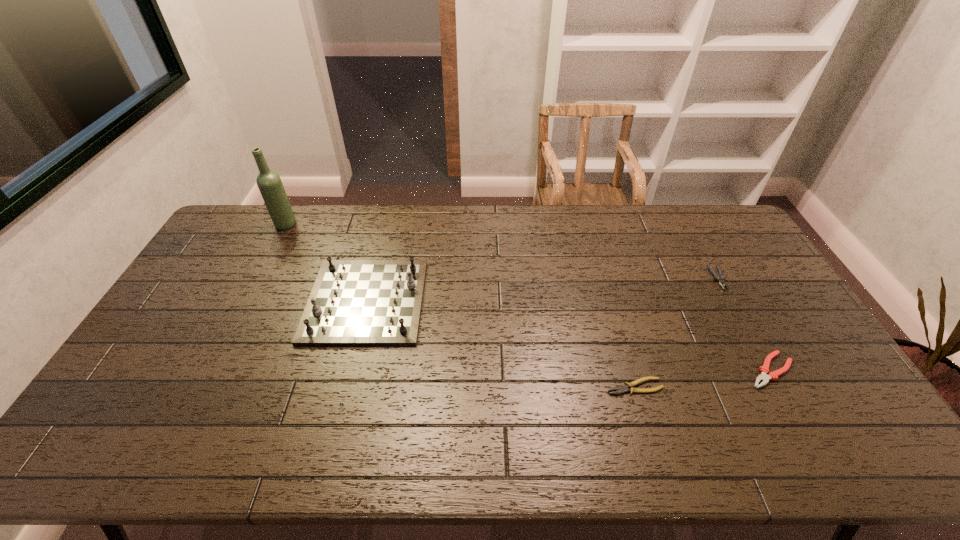
Locate an element on the screen. The height and width of the screenshot is (540, 960). free space between the third object from right to left and the second object from left to right is located at coordinates (500, 343).

At what (x,y) coordinates should I click in order to perform the action: click on free space between the chessboard and the farthest pliers. Please return your answer as a coordinate pair (x, y). Looking at the image, I should click on (542, 289).

Select which object is the third closest to the shortest pliers. Please provide its 2D coordinates. Your answer should be formatted as a tuple, i.e. [(x, y)], where the tuple contains the x and y coordinates of a point satisfying the conditions above.

[(353, 302)]

Identify which object is the second closest to the fourth object from right to left. Please provide its 2D coordinates. Your answer should be formatted as a tuple, i.e. [(x, y)], where the tuple contains the x and y coordinates of a point satisfying the conditions above.

[(620, 389)]

Image resolution: width=960 pixels, height=540 pixels. What are the coordinates of `pliers that can be found as the second closest to the chessboard` in the screenshot? It's located at (764, 369).

Identify the location of pliers that is the second closest to the shortest pliers. This screenshot has width=960, height=540. (720, 279).

The image size is (960, 540). I want to click on free space in the image that satisfies the following two spatial constraints: 1. on the board of the leftmost pliers; 2. on the right side of the second tallest object, so click(x=345, y=387).

The image size is (960, 540). I want to click on free space in the image that satisfies the following two spatial constraints: 1. on the front side of the leftmost pliers; 2. on the right side of the tallest object, so 202,387.

At what (x,y) coordinates should I click in order to perform the action: click on vacant space that satisfies the following two spatial constraints: 1. on the board of the fourth object from right to left; 2. on the right side of the shortest object. Please return your answer as a coordinate pair (x, y). Image resolution: width=960 pixels, height=540 pixels. Looking at the image, I should click on [345, 387].